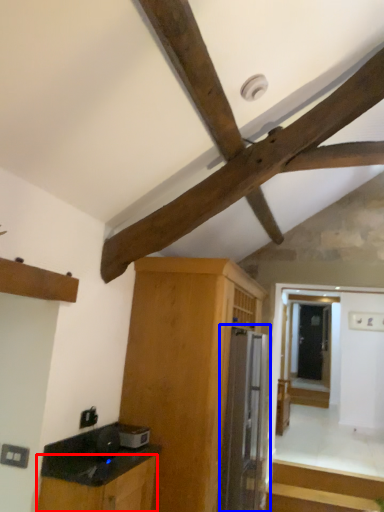
Question: Which of the following is the closest to the observer, cabinetry (highlighted by a red box) or appliance (highlighted by a blue box)?

Choices:
 (A) cabinetry
 (B) appliance

Answer: (A)